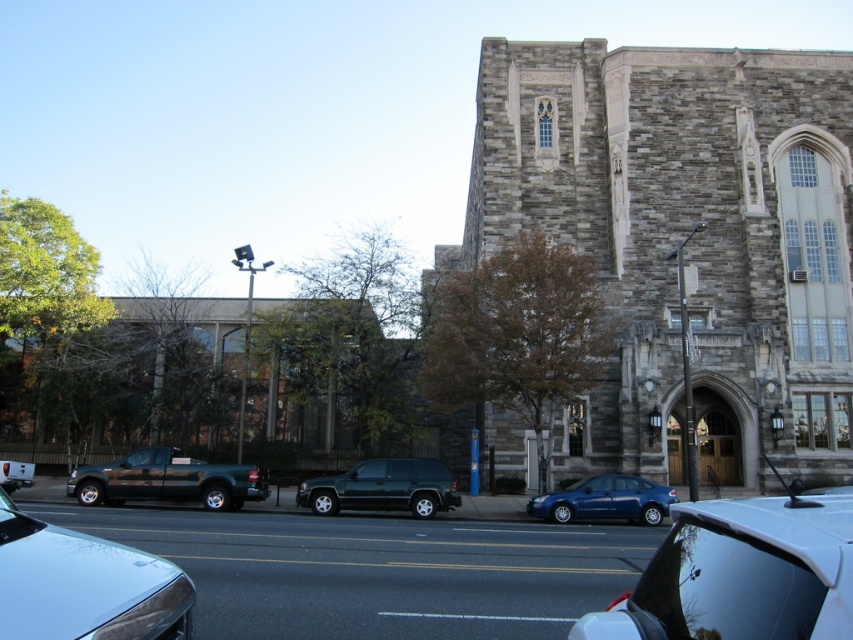
You are driving a delivery van that is 2 meters wide. You need to park your van between the gray stone church at center and the matte blue sedan at center. Based on the scene description, can you fit your van in that space?

The gray stone church at center might be wider than matte blue sedan at center, so there is uncertainty about the available space between them. Without knowing the exact width of the church and sedan, it is unclear if the 2 meter wide van can fit between them.

You are a delivery driver who needs to unload a pallet that requires 6 meters of space. You see the shiny dark green suv at center and the matte blue sedan at center. Can you fit your truck between them?

The distance between the shiny dark green suv at center and the matte blue sedan at center is 5.80 meters, which is slightly less than the required 6 meters. Therefore, the truck cannot fit between them.